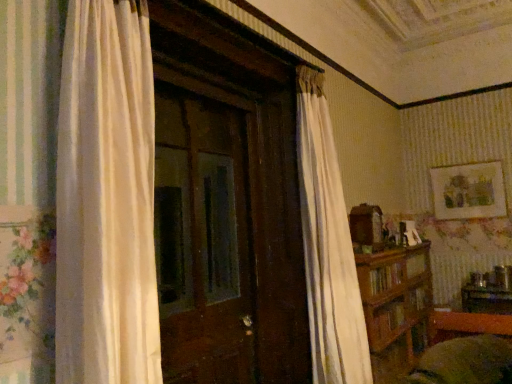
Question: Is matte gold picture frame at upper right in front of brown wooden bookshelf at right?

Choices:
 (A) no
 (B) yes

Answer: (A)

Question: From the image's perspective, is matte gold picture frame at upper right above brown wooden bookshelf at right?

Choices:
 (A) yes
 (B) no

Answer: (A)

Question: Can you confirm if matte gold picture frame at upper right is bigger than brown wooden bookshelf at right?

Choices:
 (A) yes
 (B) no

Answer: (B)

Question: From a real-world perspective, is matte gold picture frame at upper right positioned under brown wooden bookshelf at right based on gravity?

Choices:
 (A) no
 (B) yes

Answer: (A)

Question: Is matte gold picture frame at upper right outside of brown wooden bookshelf at right?

Choices:
 (A) no
 (B) yes

Answer: (B)

Question: Is matte gold picture frame at upper right aimed at brown wooden bookshelf at right?

Choices:
 (A) yes
 (B) no

Answer: (B)

Question: Is brown wooden bookshelf at right positioned far away from wooden table at lower right?

Choices:
 (A) yes
 (B) no

Answer: (A)

Question: Is brown wooden bookshelf at right closer to camera compared to wooden table at lower right?

Choices:
 (A) yes
 (B) no

Answer: (A)

Question: Is brown wooden bookshelf at right bigger than wooden table at lower right?

Choices:
 (A) no
 (B) yes

Answer: (B)

Question: Is brown wooden bookshelf at right facing away from wooden table at lower right?

Choices:
 (A) yes
 (B) no

Answer: (B)

Question: Does brown wooden bookshelf at right turn towards wooden table at lower right?

Choices:
 (A) no
 (B) yes

Answer: (A)

Question: Is brown wooden bookshelf at right taller than wooden table at lower right?

Choices:
 (A) no
 (B) yes

Answer: (B)

Question: Can you confirm if matte gold picture frame at upper right is shorter than wooden table at lower right?

Choices:
 (A) no
 (B) yes

Answer: (A)